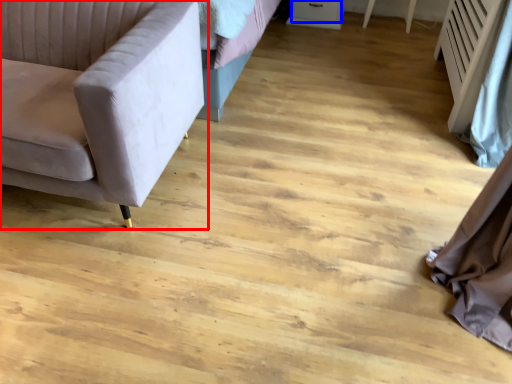
Question: Which point is further to the camera, studio couch (highlighted by a red box) or drawer (highlighted by a blue box)?

Choices:
 (A) studio couch
 (B) drawer

Answer: (B)